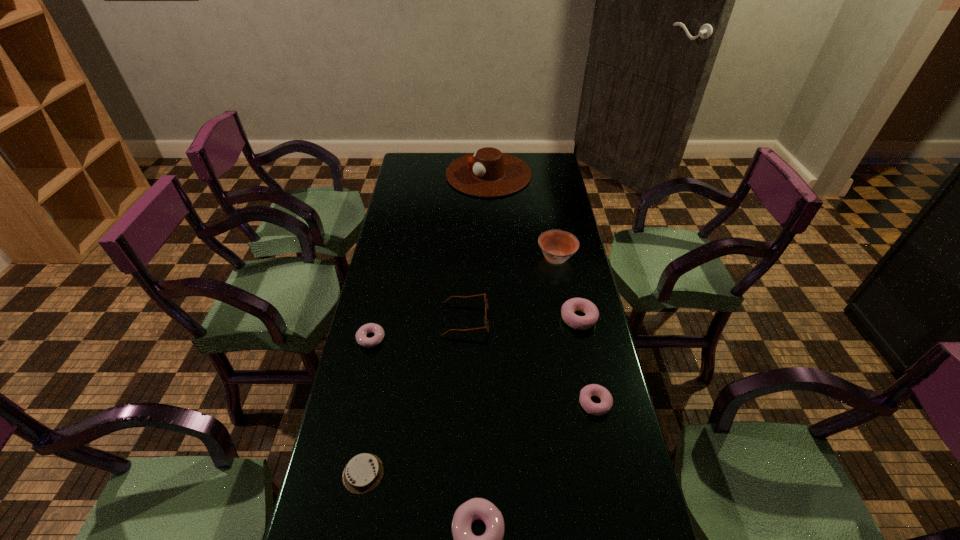
Identify which doughnut is the third closest to the farther purple doughnut. Please provide its 2D coordinates. Your answer should be formatted as a tuple, i.e. [(x, y)], where the tuple contains the x and y coordinates of a point satisfying the conditions above.

[(597, 409)]

Where is `free space that satisfies the following two spatial constraints: 1. on the front-facing side of the cowboy hat; 2. on the left side of the third nearest object`? The height and width of the screenshot is (540, 960). free space that satisfies the following two spatial constraints: 1. on the front-facing side of the cowboy hat; 2. on the left side of the third nearest object is located at coordinates (494, 403).

Image resolution: width=960 pixels, height=540 pixels. In order to click on free space that satisfies the following two spatial constraints: 1. on the front-facing side of the cowboy hat; 2. on the back side of the second nearest doughnut in this screenshot , I will do [494, 403].

Where is `vacant space that satisfies the following two spatial constraints: 1. on the front-facing side of the sixth shortest object; 2. on the front side of the farther purple doughnut`? vacant space that satisfies the following two spatial constraints: 1. on the front-facing side of the sixth shortest object; 2. on the front side of the farther purple doughnut is located at coordinates (466, 339).

This screenshot has height=540, width=960. Find the location of `vacant area in the image that satisfies the following two spatial constraints: 1. on the front-facing side of the third tallest object; 2. on the front side of the seventh farthest object`. vacant area in the image that satisfies the following two spatial constraints: 1. on the front-facing side of the third tallest object; 2. on the front side of the seventh farthest object is located at coordinates (461, 473).